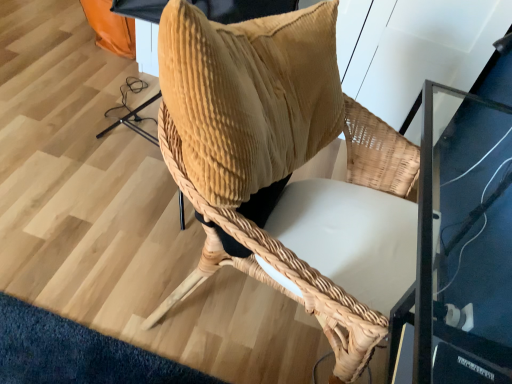
Describe the element at coordinates (249, 95) in the screenshot. I see `corduroy pillow at center` at that location.

This screenshot has height=384, width=512. Find the location of `corduroy pillow at center`. corduroy pillow at center is located at coordinates (249, 95).

The image size is (512, 384). In order to click on woven wood chair at center in this screenshot , I will do `click(268, 152)`.

What do you see at coordinates (268, 152) in the screenshot? The image size is (512, 384). I see `woven wood chair at center` at bounding box center [268, 152].

The width and height of the screenshot is (512, 384). Find the location of `corduroy pillow at center`. corduroy pillow at center is located at coordinates (249, 95).

Which object is positioned more to the left, woven wood chair at center or corduroy pillow at center?

corduroy pillow at center.

Which object is closer to the camera taking this photo, woven wood chair at center or corduroy pillow at center?

corduroy pillow at center is closer to the camera.

Which is further, (211, 126) or (266, 103)?

Positioned behind is point (266, 103).

From the image's perspective, is woven wood chair at center beneath corduroy pillow at center?

Correct, woven wood chair at center appears lower than corduroy pillow at center in the image.

From a real-world perspective, who is located higher, woven wood chair at center or corduroy pillow at center?

From a 3D spatial view, corduroy pillow at center is above.

Which of these two, woven wood chair at center or corduroy pillow at center, is wider?

woven wood chair at center is wider.

From their relative heights in the image, would you say woven wood chair at center is taller or shorter than corduroy pillow at center?

Considering their sizes, woven wood chair at center has more height than corduroy pillow at center.

Considering the relative sizes of woven wood chair at center and corduroy pillow at center in the image provided, is woven wood chair at center bigger than corduroy pillow at center?

Yes.

Choose the correct answer: Is woven wood chair at center inside corduroy pillow at center or outside it?

The correct answer is: outside.

Is there a large distance between woven wood chair at center and corduroy pillow at center?

No, woven wood chair at center is not far away from corduroy pillow at center.

Is woven wood chair at center oriented away from corduroy pillow at center?

No, woven wood chair at center is not facing the opposite direction of corduroy pillow at center.

Can you tell me how much woven wood chair at center and corduroy pillow at center differ in facing direction?

There is a 2.39e-05-degree angle between the facing directions of woven wood chair at center and corduroy pillow at center.

How far apart are woven wood chair at center and corduroy pillow at center?

woven wood chair at center and corduroy pillow at center are 2.59 inches apart.

The width and height of the screenshot is (512, 384). I want to click on chair on the right of corduroy pillow at center, so click(268, 152).

Visually, is corduroy pillow at center positioned to the left or to the right of woven wood chair at center?

From the image, it's evident that corduroy pillow at center is to the left of woven wood chair at center.

Is corduroy pillow at center positioned before woven wood chair at center?

Yes, corduroy pillow at center is in front of woven wood chair at center.

Does point (274, 16) appear closer or farther from the camera than point (221, 212)?

Point (274, 16) is farther from the camera than point (221, 212).

In the scene shown: From the image's perspective, would you say corduroy pillow at center is shown under woven wood chair at center?

No.

From a real-world perspective, is corduroy pillow at center positioned under woven wood chair at center based on gravity?

No, from a real-world perspective, corduroy pillow at center is not beneath woven wood chair at center.

Which of these two, corduroy pillow at center or woven wood chair at center, is thinner?

With smaller width is corduroy pillow at center.

Can you confirm if corduroy pillow at center is taller than woven wood chair at center?

No.

Based on their sizes in the image, would you say corduroy pillow at center is bigger or smaller than woven wood chair at center?

Considering their sizes, corduroy pillow at center takes up less space than woven wood chair at center.

Is corduroy pillow at center inside the boundaries of woven wood chair at center, or outside?

corduroy pillow at center lies within the bounds of woven wood chair at center.

Is corduroy pillow at center not close to woven wood chair at center?

That's not correct — corduroy pillow at center is a little close to woven wood chair at center.

Is corduroy pillow at center facing towards woven wood chair at center?

No.

Find the location of a particular element. This screenshot has height=384, width=512. pillow in front of the woven wood chair at center is located at coordinates (249, 95).

Image resolution: width=512 pixels, height=384 pixels. In order to click on chair located underneath the corduroy pillow at center (from a real-world perspective) in this screenshot , I will do `click(268, 152)`.

Where is `chair on the right of corduroy pillow at center`? The width and height of the screenshot is (512, 384). chair on the right of corduroy pillow at center is located at coordinates (268, 152).